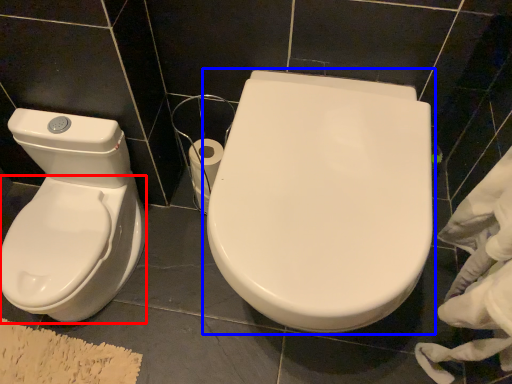
Question: Which point is closer to the camera, bidet (highlighted by a red box) or toilet (highlighted by a blue box)?

Choices:
 (A) bidet
 (B) toilet

Answer: (B)